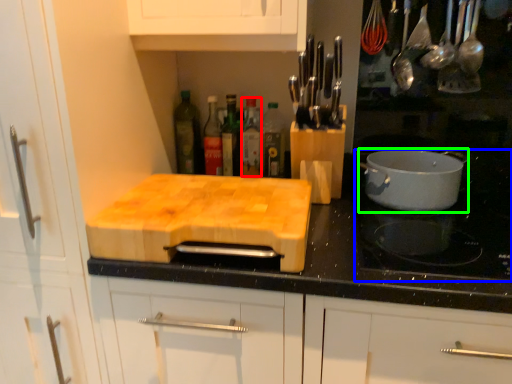
Question: Which is nearer to the bottle (highlighted by a red box)? gas stove (highlighted by a blue box) or kitchen appliance (highlighted by a green box).

Choices:
 (A) gas stove
 (B) kitchen appliance

Answer: (B)